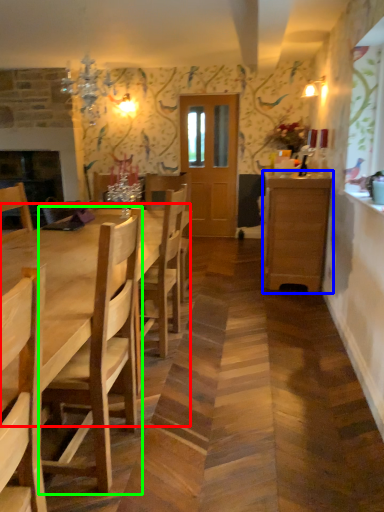
Question: Considering the real-world distances, which object is farthest from kitchen & dining room table (highlighted by a red box)? cabinetry (highlighted by a blue box) or chair (highlighted by a green box)?

Choices:
 (A) cabinetry
 (B) chair

Answer: (A)